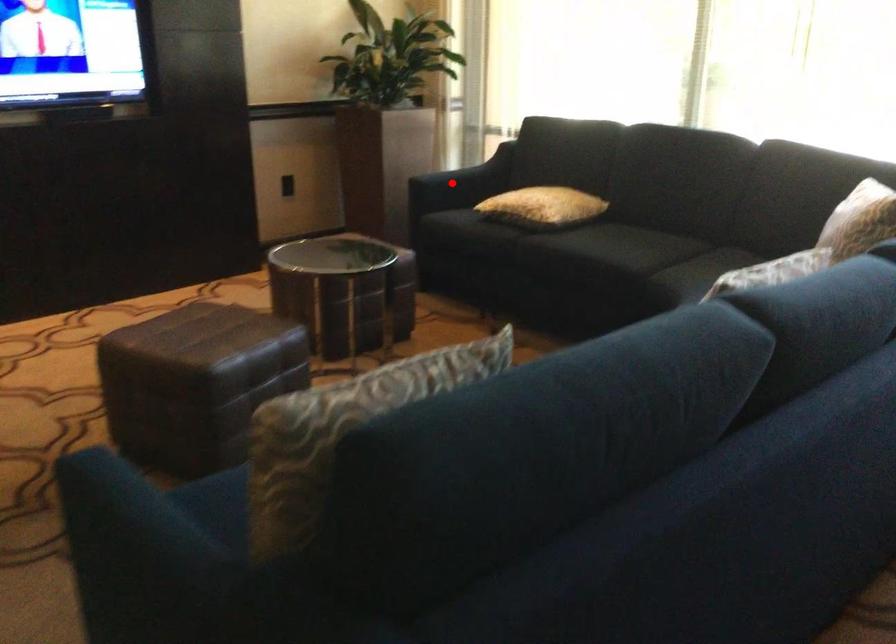
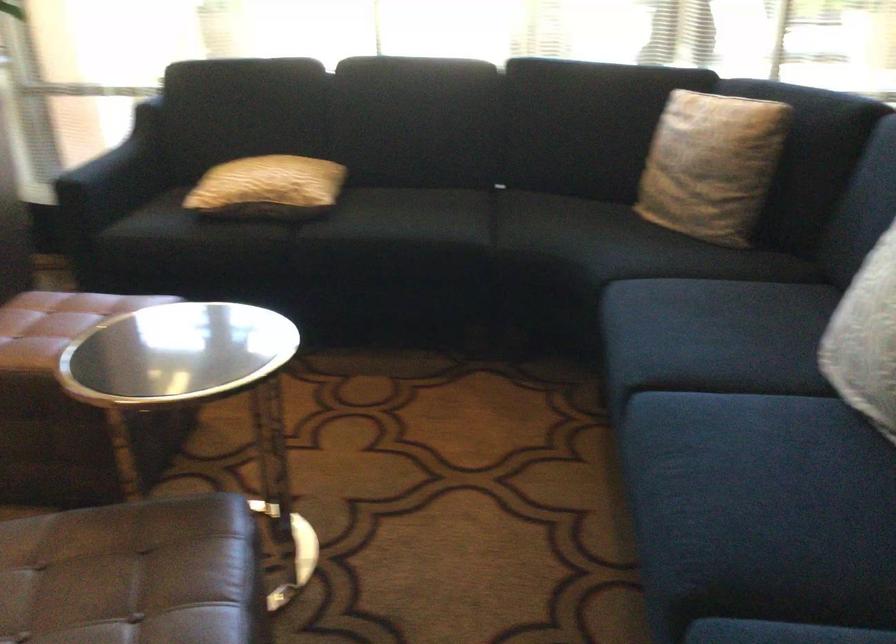
Find the pixel in the second image that matches the highlighted location in the first image.

(115, 176)